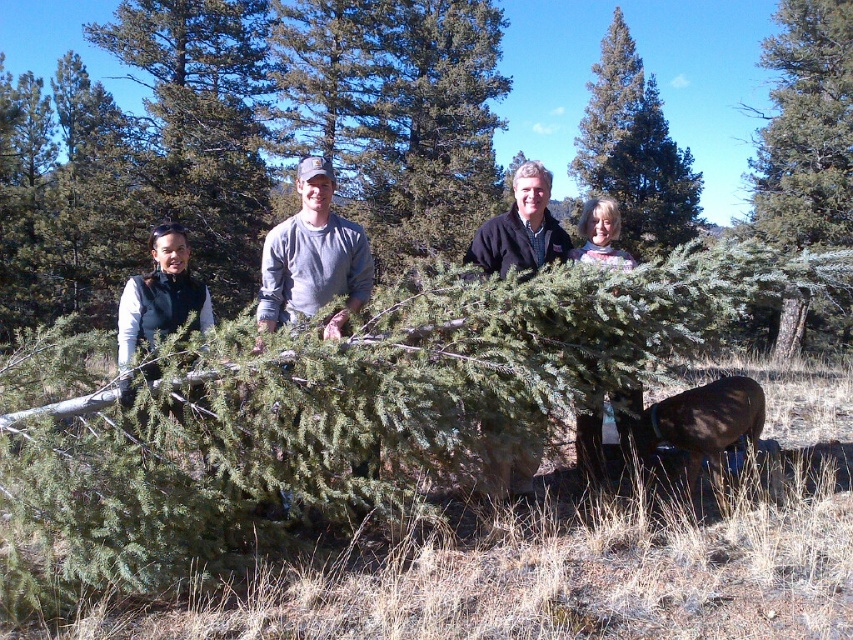
You are standing in the forest and see the green leafy tree at center and the black fleece jacket at center. Which object is closer to you?

The green leafy tree at center is closer to you because it is in front of the black fleece jacket at center.

You are standing at the origin point of the image. Which direction should you move to reach the green leafy tree at center?

The green leafy tree at center is located at point coordinates of 0.202 on the x axis and 0.946 on the y axis. Since you are at the origin point, you should move towards the right and down to reach it.